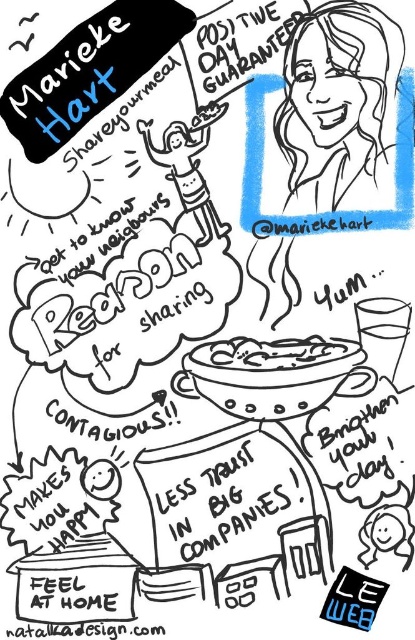
Does point (293, 74) come farther from viewer compared to point (288, 358)?

No.

Between sketchy hair at upper right and white matte bowl at center, which one appears on the left side from the viewer's perspective?

white matte bowl at center is more to the left.

Which is in front, point (314, 36) or point (336, 358)?

Point (314, 36)

Locate an element on the screen. The height and width of the screenshot is (640, 415). sketchy hair at upper right is located at coordinates (336, 97).